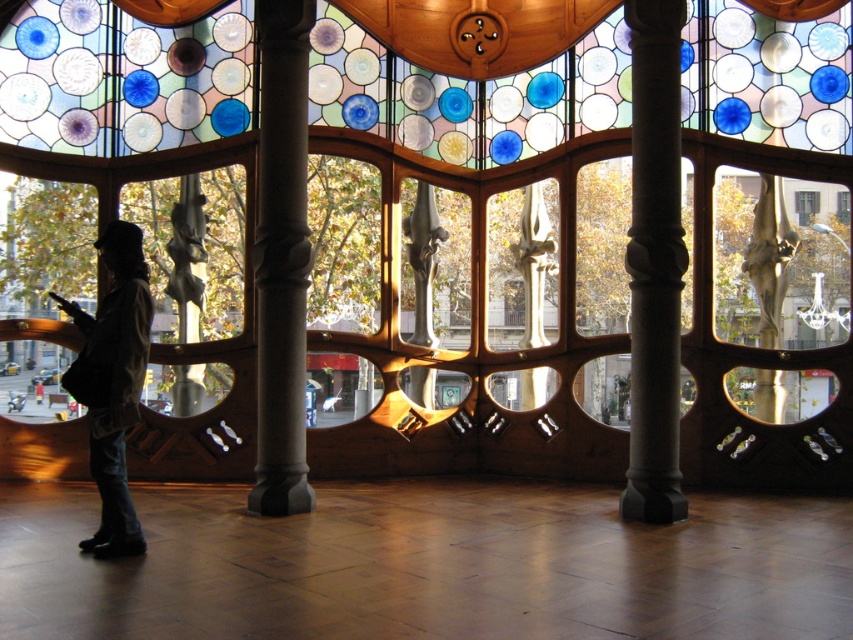
Question: Which of these objects is positioned closest to the metallic gray sculpture at center?

Choices:
 (A) camouflage jacket at left
 (B) carved stone column at center
 (C) slate gray stone column at center

Answer: (C)

Question: Among these objects, which one is farthest from the camera?

Choices:
 (A) slate gray stone column at center
 (B) camouflage jacket at left
 (C) metallic gray sculpture at center

Answer: (C)

Question: Which of these objects is positioned farthest from the metallic gray sculpture at center?

Choices:
 (A) camouflage jacket at left
 (B) carved stone column at center

Answer: (A)

Question: Does slate gray stone column at center appear under camouflage jacket at left?

Choices:
 (A) no
 (B) yes

Answer: (A)

Question: Is polished bronze statue at center closer to camera compared to metallic gray sculpture at center?

Choices:
 (A) no
 (B) yes

Answer: (A)

Question: Does carved stone column at center have a greater width compared to polished bronze statue at center?

Choices:
 (A) yes
 (B) no

Answer: (A)